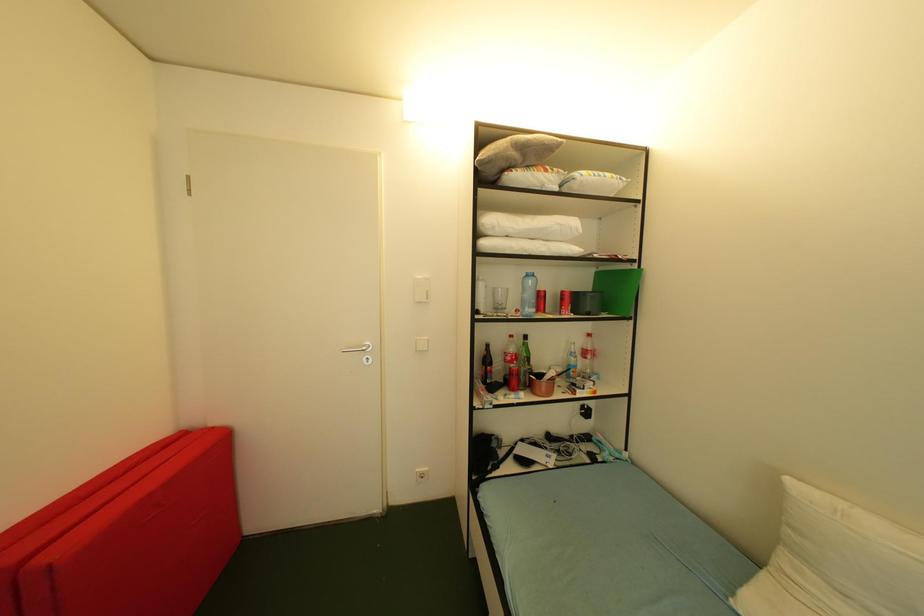
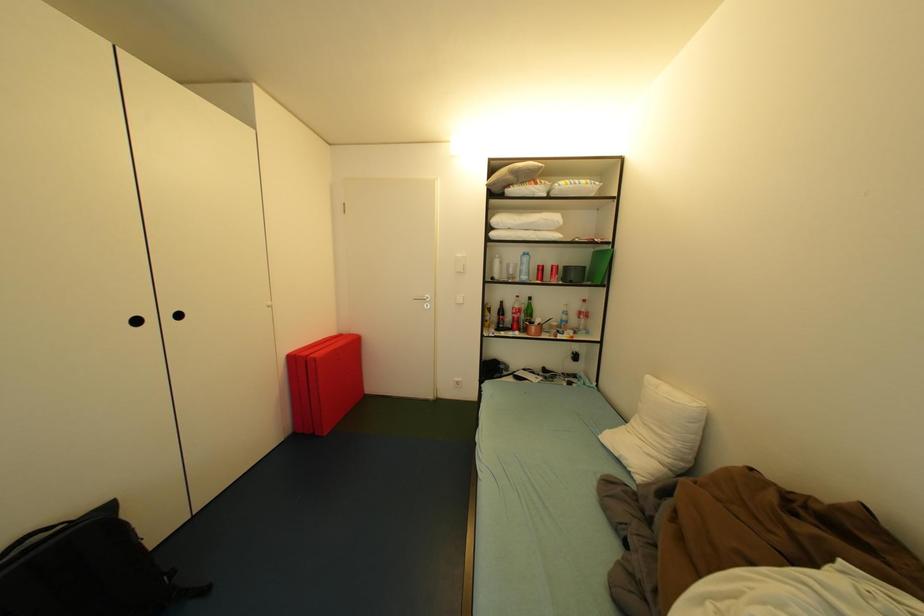
Question: The first image is from the beginning of the video and the second image is from the end. How did the camera likely rotate when shooting the video?

Choices:
 (A) Left
 (B) Right
 (C) Up
 (D) Down

Answer: (A)